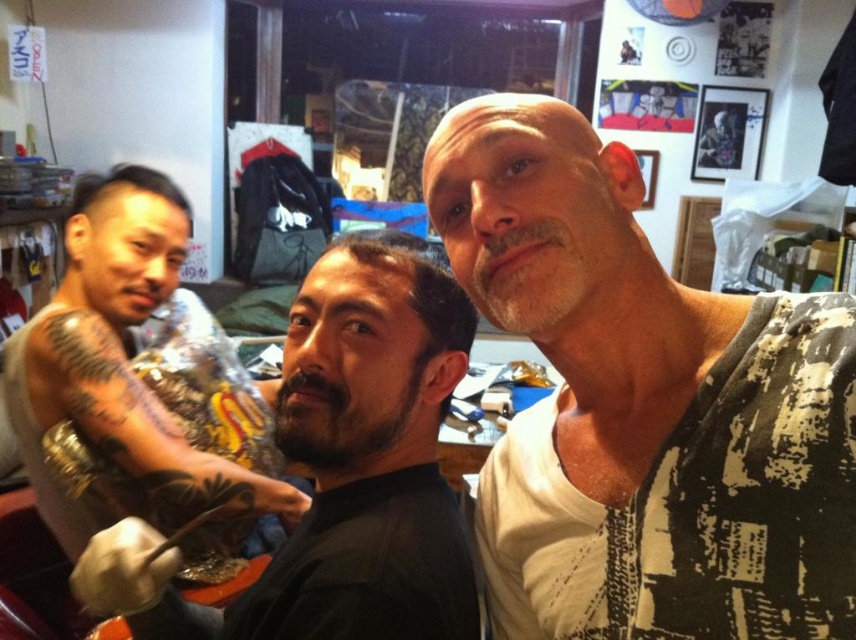
Is white textured shirt at upper right wider than black matte shirt at center?

In fact, white textured shirt at upper right might be narrower than black matte shirt at center.

Between white textured shirt at upper right and black matte shirt at center, which one appears on the left side from the viewer's perspective?

Positioned to the left is black matte shirt at center.

What do you see at coordinates (643, 404) in the screenshot? This screenshot has height=640, width=856. I see `white textured shirt at upper right` at bounding box center [643, 404].

Find the location of a particular element. The height and width of the screenshot is (640, 856). white textured shirt at upper right is located at coordinates (643, 404).

Does black matte shirt at center appear on the left side of black tattooed arm at left?

Incorrect, black matte shirt at center is not on the left side of black tattooed arm at left.

Does point (372, 262) come farther from viewer compared to point (164, 504)?

That is False.

Does point (367, 422) come farther from viewer compared to point (181, 451)?

No, it is not.

Identify the location of black matte shirt at center. (340, 472).

Is black tattooed arm at left below dark brown hair at center?

Yes, black tattooed arm at left is below dark brown hair at center.

Is black tattooed arm at left thinner than dark brown hair at center?

No, black tattooed arm at left is not thinner than dark brown hair at center.

Which is in front, point (163, 493) or point (411, 288)?

Point (411, 288) is in front.

Find the location of `black tattooed arm at left`. black tattooed arm at left is located at coordinates (141, 426).